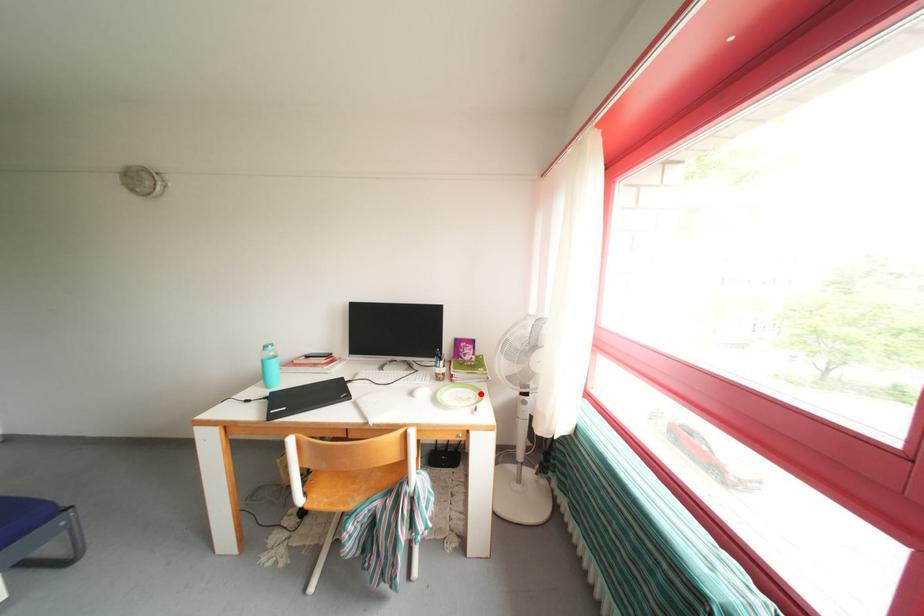
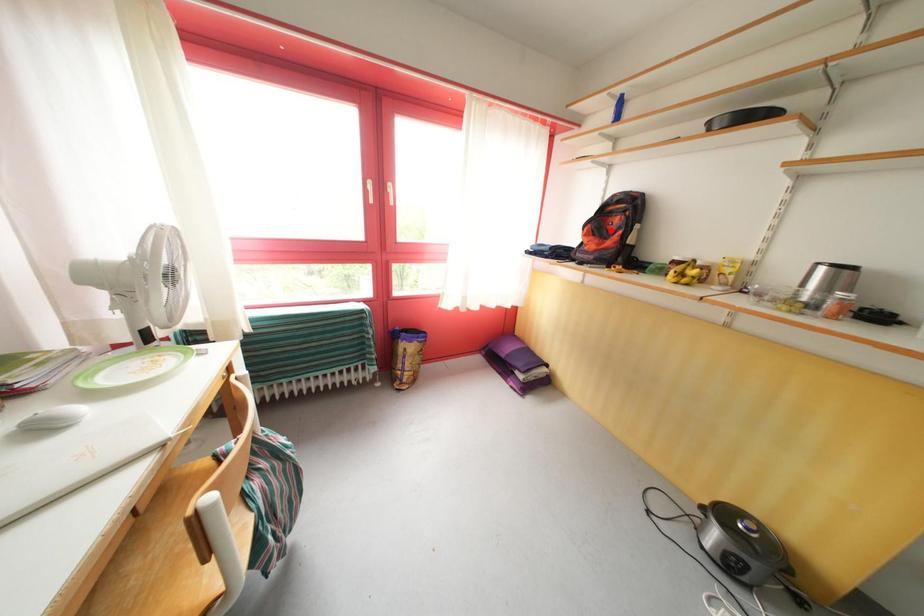
I am providing you with two images of the same scene from different viewpoints. A red point is marked on the first image and another point is marked on the second image. Are the points marked in image1 and image2 representing the same 3D position?

No